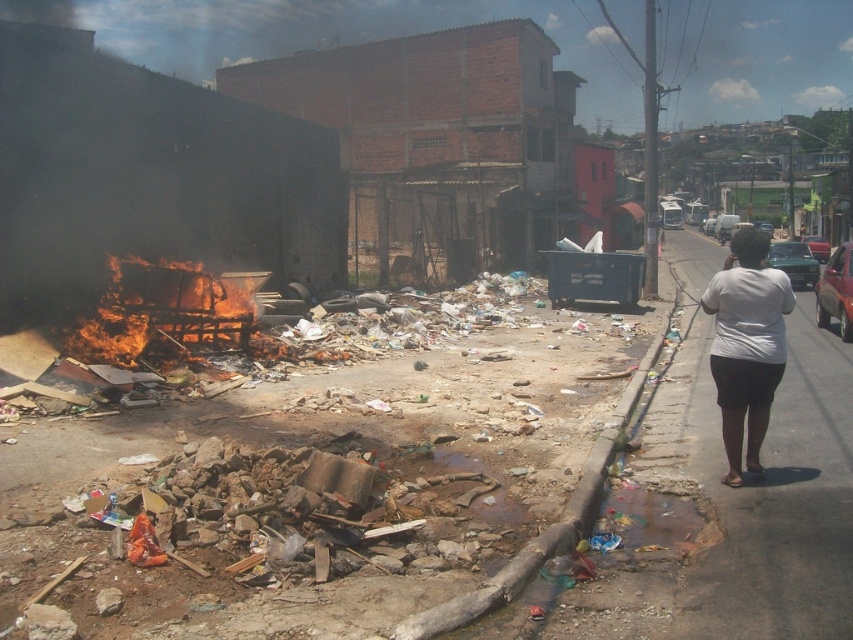
Question: Considering the relative positions of white cotton shirt at right and brown concrete curb at lower center in the image provided, where is white cotton shirt at right located with respect to brown concrete curb at lower center?

Choices:
 (A) below
 (B) above

Answer: (B)

Question: Which of these objects is positioned closest to the white cotton shirt at right?

Choices:
 (A) flaming wood at left
 (B) brown concrete curb at lower center

Answer: (B)

Question: Which object appears closest to the camera in this image?

Choices:
 (A) flaming wood at left
 (B) white cotton shirt at right

Answer: (B)

Question: Is white cotton shirt at right thinner than brown concrete curb at lower center?

Choices:
 (A) no
 (B) yes

Answer: (B)

Question: Can you confirm if flaming wood at left is positioned below brown concrete curb at lower center?

Choices:
 (A) yes
 (B) no

Answer: (B)

Question: Estimate the real-world distances between objects in this image. Which object is closer to the brown concrete curb at lower center?

Choices:
 (A) white cotton shirt at right
 (B) flaming wood at left

Answer: (A)